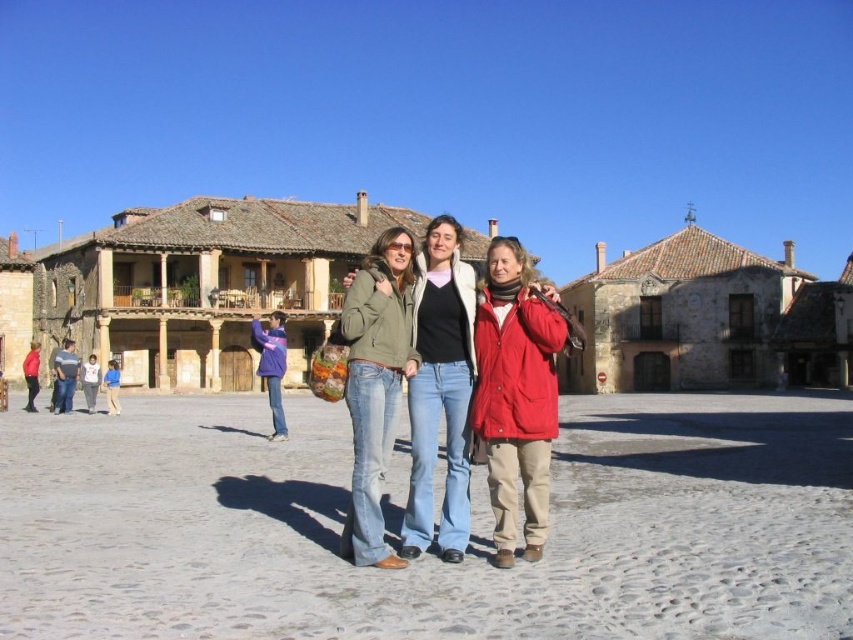
Question: Can you confirm if matte green jacket at center is positioned to the right of purple fleece jacket at lower left?

Choices:
 (A) no
 (B) yes

Answer: (B)

Question: Which object is the farthest from the blue denim jeans at lower left?

Choices:
 (A) purple fleece jacket at lower left
 (B) matte black jacket at center

Answer: (B)

Question: Which object is positioned farthest from the blue denim jeans at lower left?

Choices:
 (A) matte black jacket at center
 (B) matte red jacket at center

Answer: (B)

Question: Does matte red jacket at center have a greater width compared to matte black jacket at center?

Choices:
 (A) no
 (B) yes

Answer: (A)

Question: Is matte red jacket at center to the left of blue denim jeans at lower left from the viewer's perspective?

Choices:
 (A) yes
 (B) no

Answer: (B)

Question: Which point is closer to the camera?

Choices:
 (A) purple fleece jacket at lower left
 (B) matte red jacket at center
 (C) matte green jacket at center
 (D) matte black jacket at center

Answer: (C)